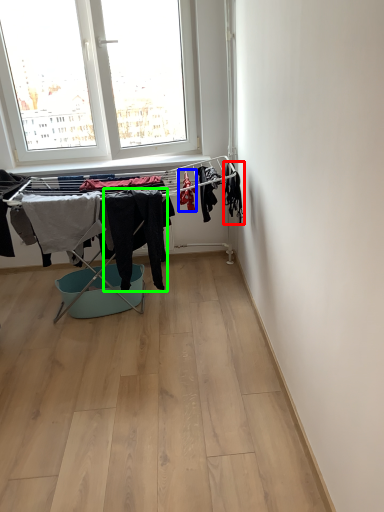
Question: Which is nearer to the clothing (highlighted by a red box)? clothing (highlighted by a blue box) or clothing (highlighted by a green box).

Choices:
 (A) clothing
 (B) clothing

Answer: (A)